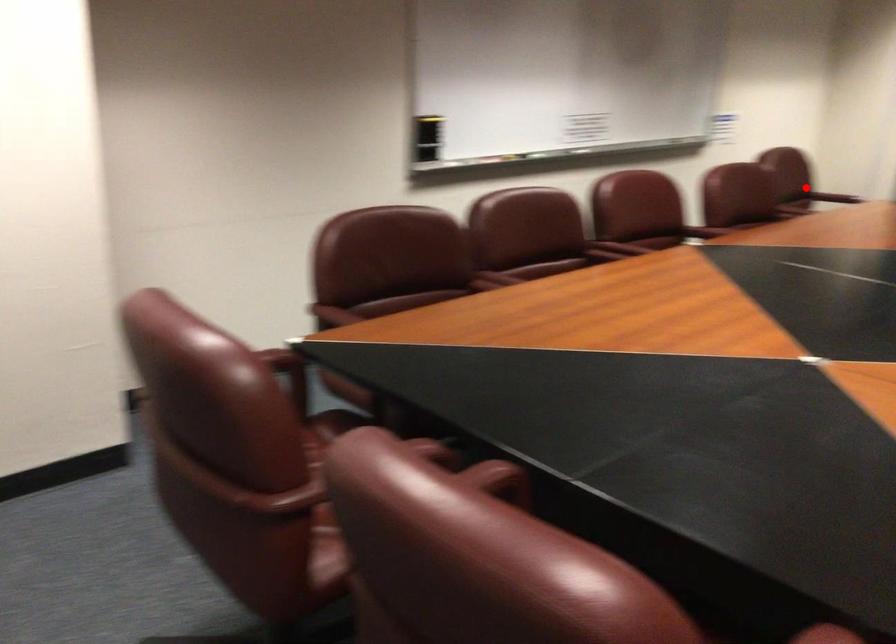
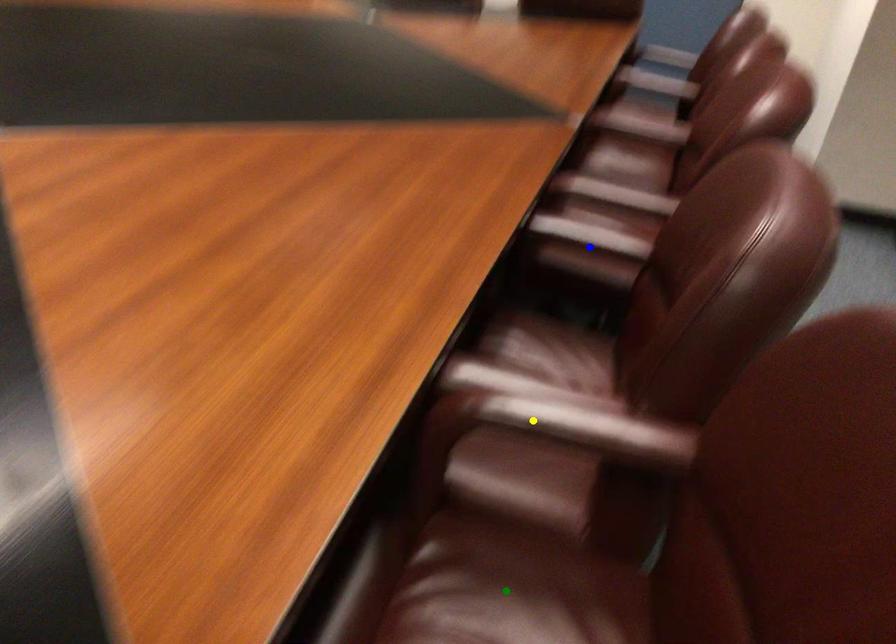
Question: I am providing you with two images of the same scene from different viewpoints. A red point is marked on the first image. You are given multiple points on the second image. Which point in image 2 represents the same 3d spot as the red point in image 1?

Choices:
 (A) green point
 (B) yellow point
 (C) blue point

Answer: (B)